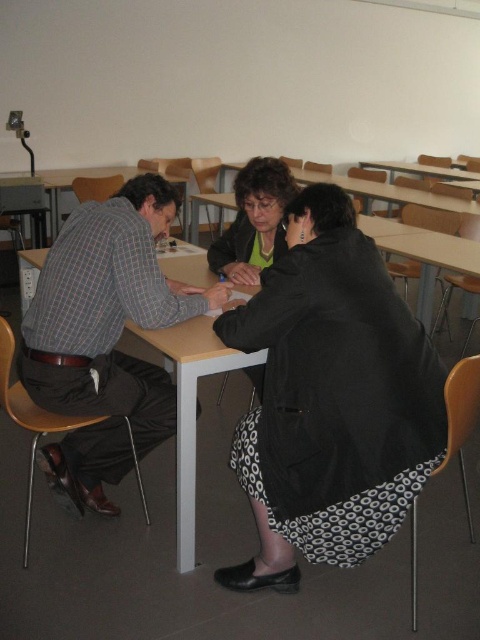
You are a photographer standing 5 feet away from a table in a classroom. You want to take a closeup photo of the black textured skirt at lower center. Is the skirt within your camera range? Please explain.

The black textured skirt at lower center is 4.99 feet from the camera. Since the photographer is standing 5 feet away from the table, the skirt is just within the camera range as it is slightly closer than the photographer.